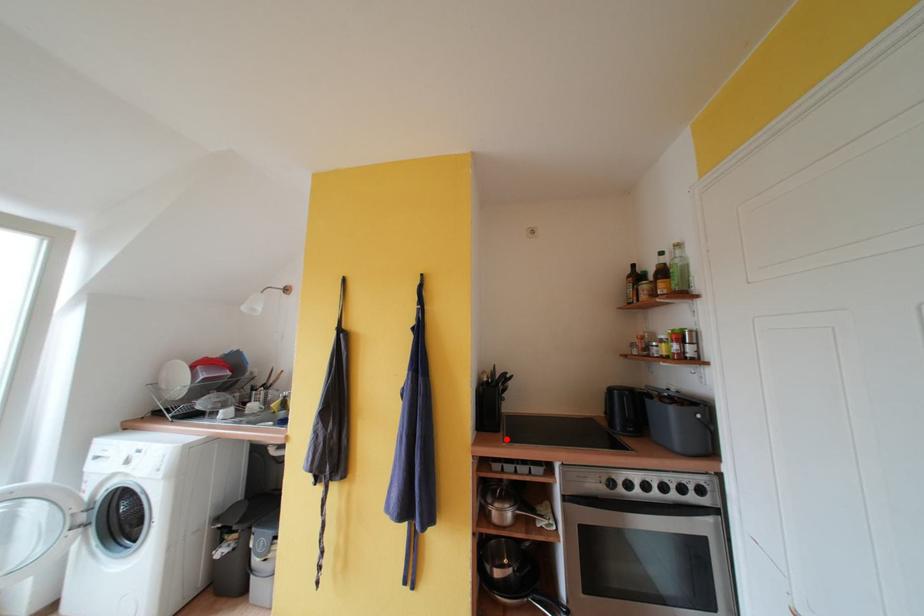
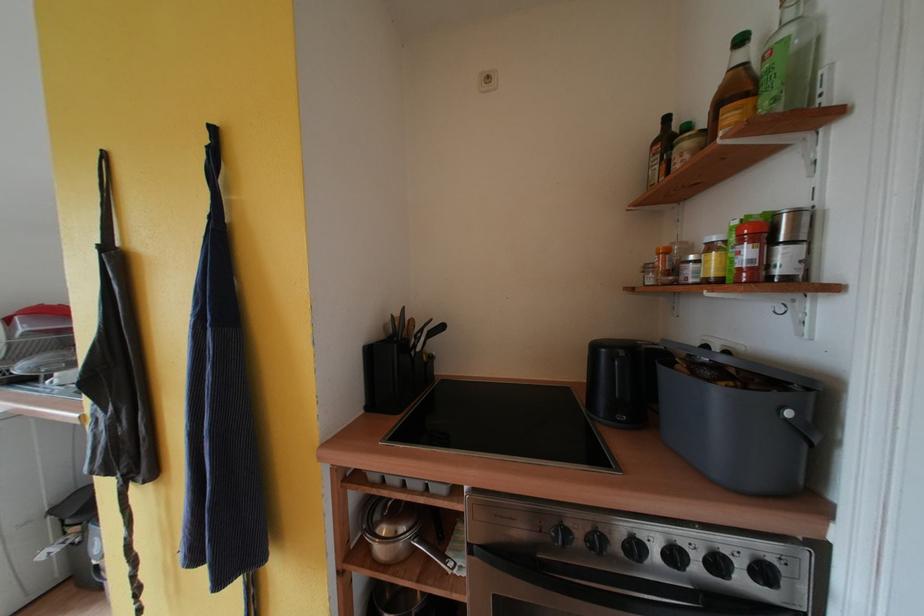
In the second image, find the point that corresponds to the highlighted location in the first image.

(399, 426)